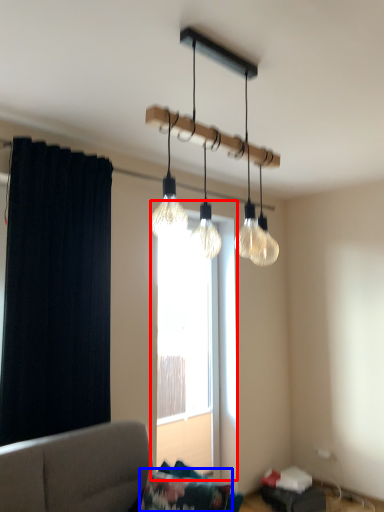
Question: Which of the following is the farthest to the observer, window (highlighted by a red box) or pillow (highlighted by a blue box)?

Choices:
 (A) window
 (B) pillow

Answer: (A)